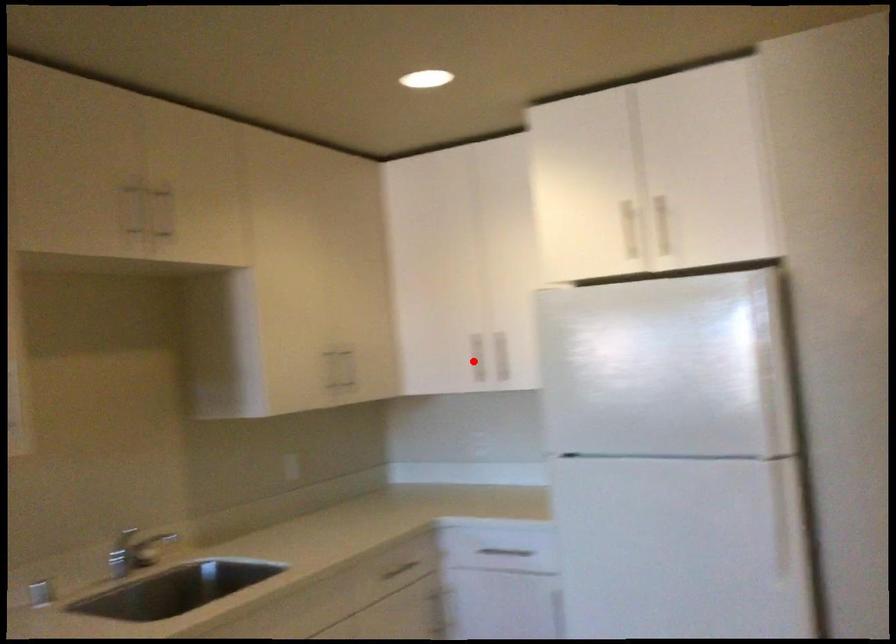
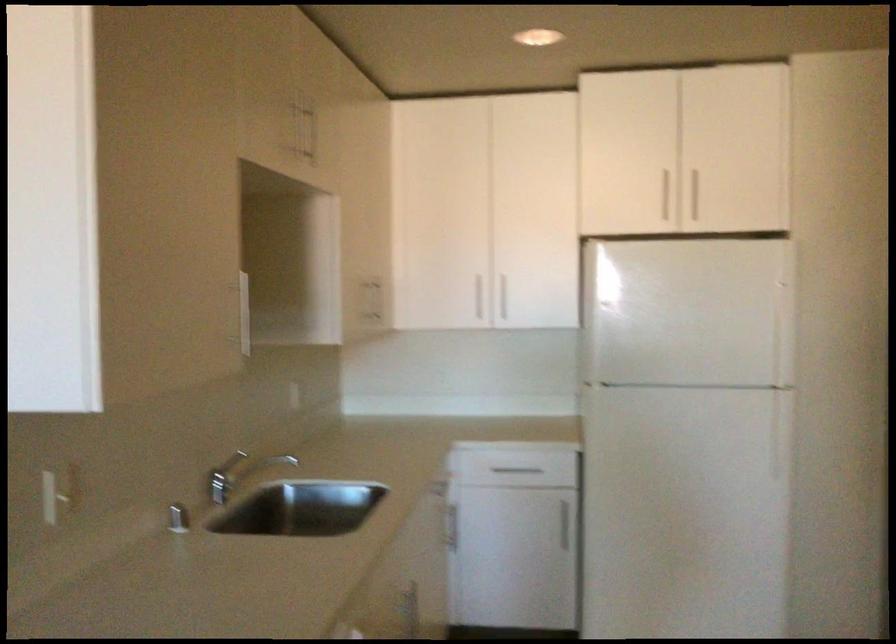
Find the pixel in the second image that matches the highlighted location in the first image.

(476, 299)